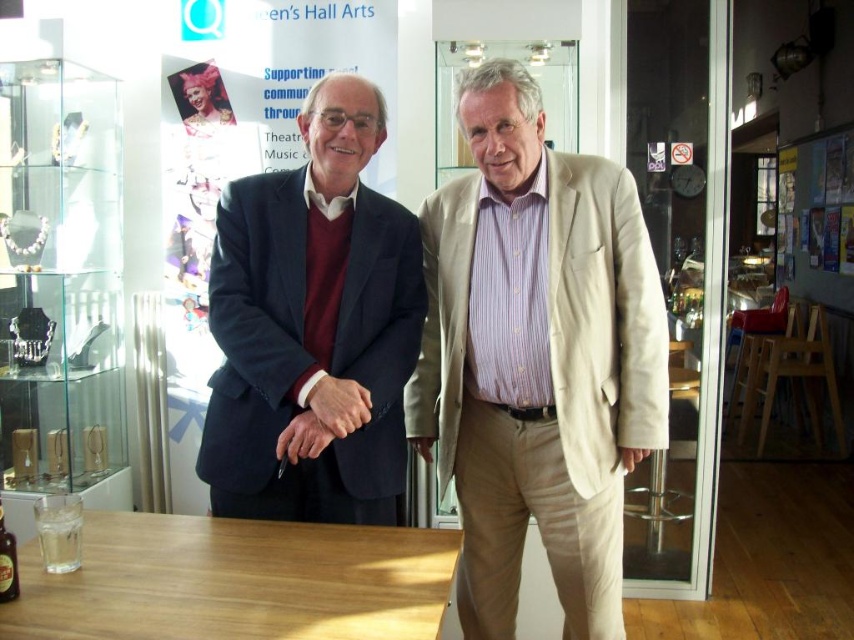
Question: Observing the image, what is the correct spatial positioning of beige cotton suit at center in reference to matte black suit at center?

Choices:
 (A) below
 (B) above

Answer: (A)

Question: Which object is closer to the camera taking this photo?

Choices:
 (A) light brown wood table at center
 (B) beige cotton suit at center

Answer: (A)

Question: Can you confirm if beige cotton suit at center is wider than matte black suit at center?

Choices:
 (A) no
 (B) yes

Answer: (B)

Question: Which of the following is the closest to the observer?

Choices:
 (A) (9, 554)
 (B) (309, 545)
 (C) (430, 346)

Answer: (A)

Question: Which point is farther to the camera?

Choices:
 (A) beige cotton suit at center
 (B) light brown wood table at center

Answer: (A)

Question: Does beige cotton suit at center appear on the right side of light brown wood table at center?

Choices:
 (A) yes
 (B) no

Answer: (A)